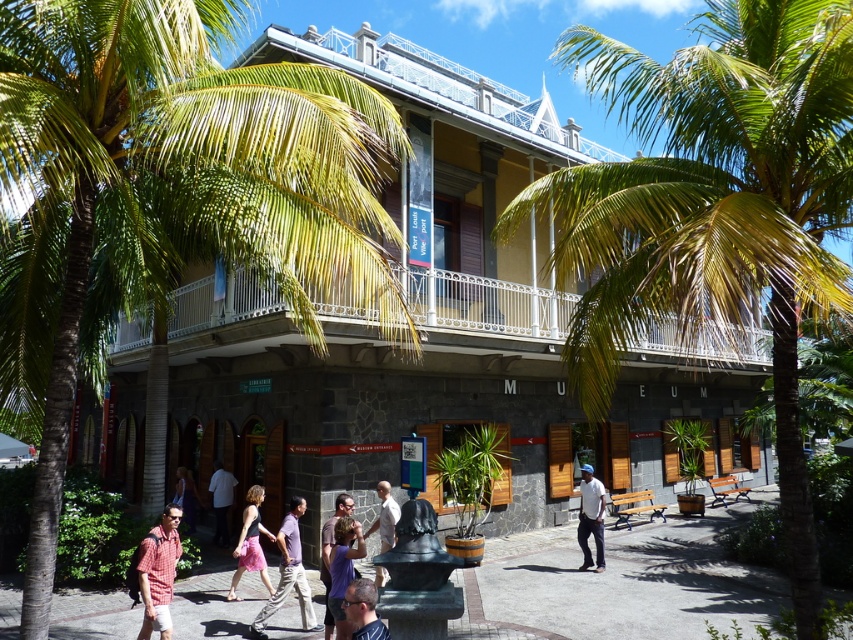
You are a photographer standing in front of the MUSEUM. You want to take a photo of the two people wearing the light purple shirt at center and matte purple shirt at center. The minimum distance required for your camera to focus clearly on both subjects is 5 feet. Will you be able to capture both subjects in focus without moving closer?

The light purple shirt at center and matte purple shirt at center are 4.94 feet apart, which is less than the 5 feet minimum distance required. Therefore, the camera can focus clearly on both subjects without moving closer.

Consider the image. You are a photographer standing at the edge of the paved area near the museum. You want to capture both the plaid shirt at lower left and the matte black top at center in a single shot without moving your position. Can you fit both subjects into your camera frame if your camera has a 1.5 meter field of view?

The plaid shirt at lower left is 2.34 meters away from the matte black top at center. Since the distance between them exceeds the camera field of view of 1.5 meters, you cannot fit both subjects into the frame without moving.

You are standing in front of the MUSEUM and see the green leafy palm tree at center and the matte white shirt at center. Which object is higher from the ground?

The green leafy palm tree at center is located above the matte white shirt at center, so it is higher from the ground.